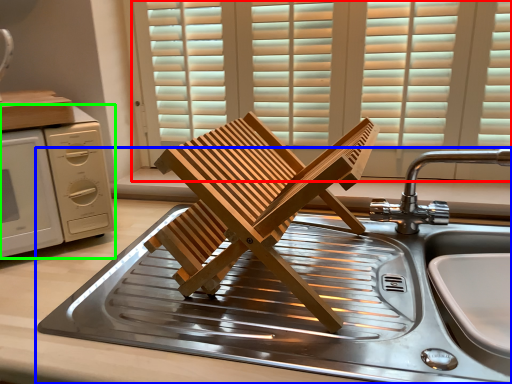
Question: Based on their relative distances, which object is farther from window (highlighted by a red box)? Choose from sink (highlighted by a blue box) and home appliance (highlighted by a green box).

Choices:
 (A) sink
 (B) home appliance

Answer: (B)